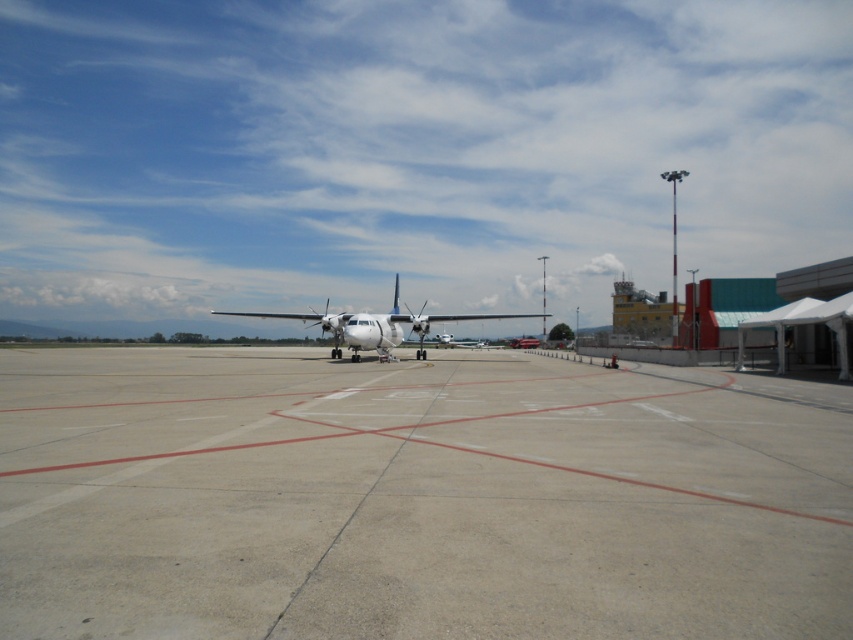
You are a pilot standing on the gray concrete tarmac at center. You need to walk to the white matte airplane at center to board it. Can you reach the airplane within 10 seconds if you walk at a normal pace of 1.4 meters per second?

The gray concrete tarmac at center is 22.72 meters away from the white matte airplane at center. At a walking speed of 1.4 meters per second, it would take approximately 16.23 seconds to cover the distance. Therefore, you cannot reach the airplane within 10 seconds.

You are a pilot who just landed the white matte airplane at center. You need to park it on the gray concrete tarmac at center. Is the airplane already parked on the tarmac?

Yes, the white matte airplane at center is already parked on the gray concrete tarmac at center because the gray concrete tarmac at center is positioned under the white matte airplane at center.